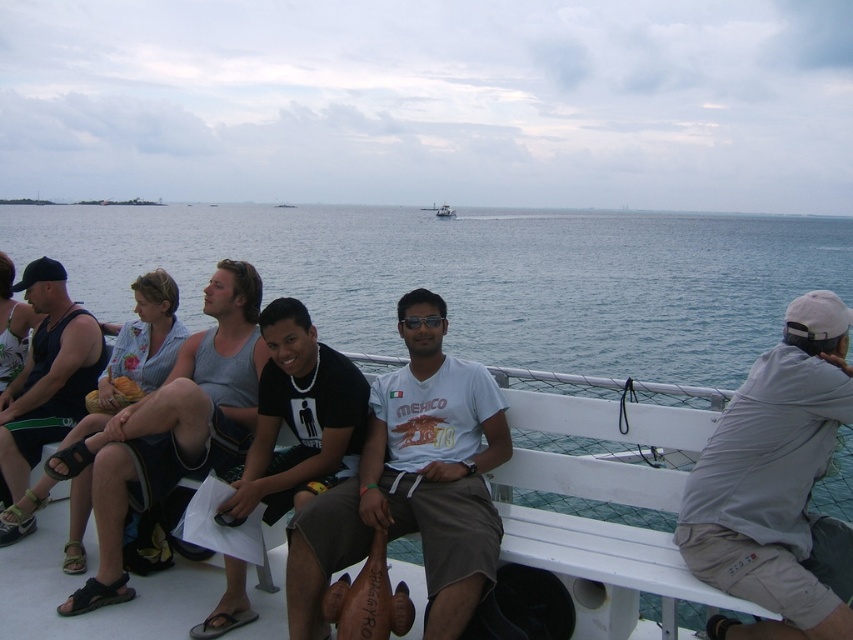
Who is shorter, white cotton shirt at center or white plastic boat at center?

With less height is white cotton shirt at center.

Does point (422, 515) come behind point (451, 209)?

No, it is not.

You are a GUI agent. You are given a task and a screenshot of the screen. Output one action in this format:
    pyautogui.click(x=<x>, y=<y>)
    Task: Click on the white cotton shirt at center
    
    Given the screenshot: What is the action you would take?
    pyautogui.click(x=412, y=481)

Between white cotton shirt at center and black matte t-shirt at center, which one is positioned lower?

black matte t-shirt at center is below.

Is point (405, 314) positioned behind point (268, 456)?

No.

Where is `white cotton shirt at center`? The width and height of the screenshot is (853, 640). white cotton shirt at center is located at coordinates (412, 481).

Who is lower down, gray cotton shirt at right or matte black tank top at left?

gray cotton shirt at right is below.

Does gray cotton shirt at right have a smaller size compared to matte black tank top at left?

Yes, gray cotton shirt at right is smaller than matte black tank top at left.

Does point (804, 372) come behind point (22, 440)?

No, it is not.

In order to click on gray cotton shirt at right in this screenshot , I will do `click(773, 480)`.